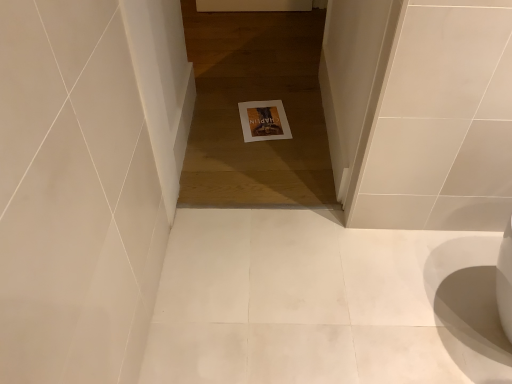
Question: From a real-world perspective, relative to white paper at center, is white paper at center vertically above or below?

Choices:
 (A) below
 (B) above

Answer: (B)

Question: Is point (220, 170) closer or farther from the camera than point (247, 140)?

Choices:
 (A) farther
 (B) closer

Answer: (B)

Question: Looking at the image, does white paper at center seem bigger or smaller compared to white paper at center?

Choices:
 (A) big
 (B) small

Answer: (A)

Question: From a real-world perspective, relative to white paper at center, is white paper at center vertically above or below?

Choices:
 (A) below
 (B) above

Answer: (A)

Question: From the image's perspective, is white paper at center positioned above or below white paper at center?

Choices:
 (A) above
 (B) below

Answer: (B)

Question: In the image, is white paper at center positioned in front of or behind white paper at center?

Choices:
 (A) behind
 (B) front

Answer: (A)

Question: Considering the positions of point (x=284, y=122) and point (x=201, y=79), is point (x=284, y=122) closer or farther from the camera than point (x=201, y=79)?

Choices:
 (A) farther
 (B) closer

Answer: (B)